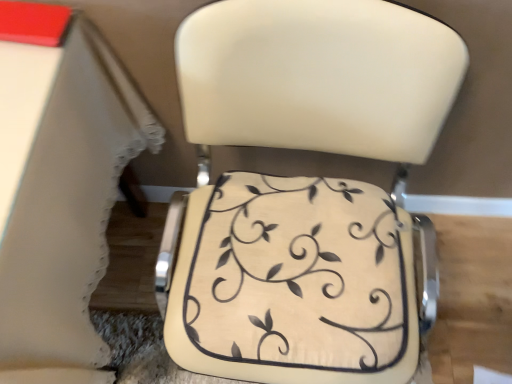
Question: From a real-world perspective, is beige fabric cushion at center positioned above or below matte cream cushion at center?

Choices:
 (A) above
 (B) below

Answer: (A)

Question: From their relative heights in the image, would you say beige fabric cushion at center is taller or shorter than matte cream cushion at center?

Choices:
 (A) short
 (B) tall

Answer: (A)

Question: Which object is positioned farthest from the matte cream cushion at center?

Choices:
 (A) beige fabric cushion at center
 (B) white lace tablecloth at lower left

Answer: (B)

Question: Estimate the real-world distances between objects in this image. Which object is farther from the white lace tablecloth at lower left?

Choices:
 (A) matte cream cushion at center
 (B) beige fabric cushion at center

Answer: (B)